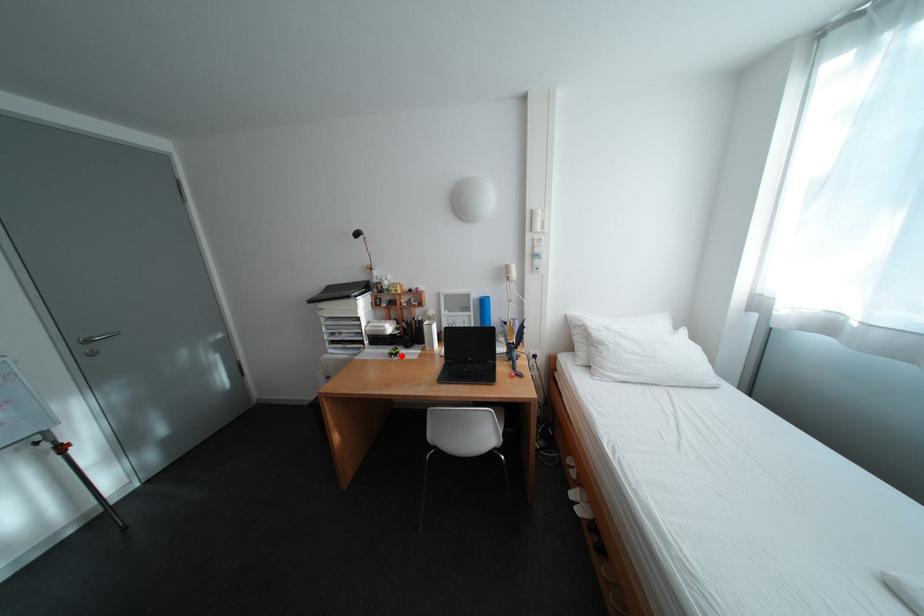
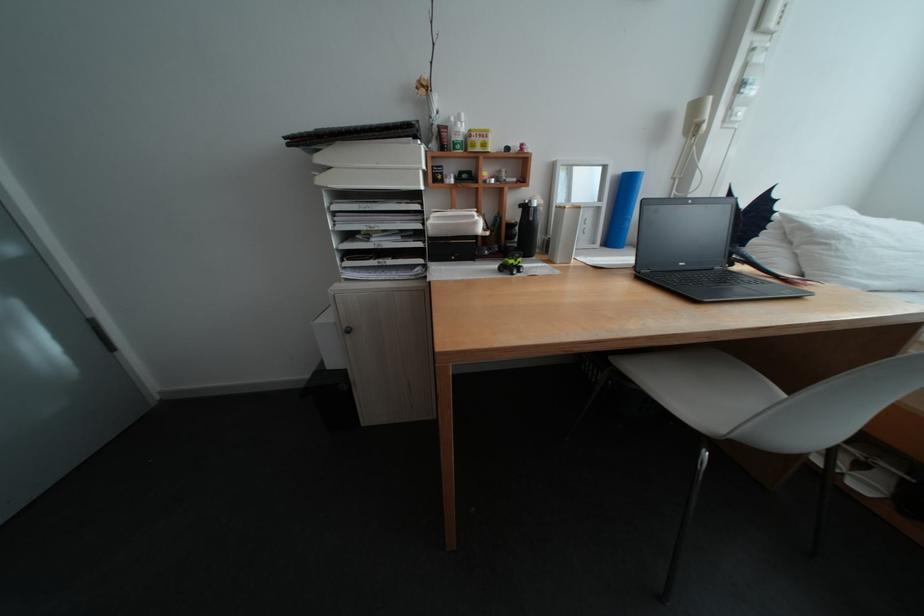
Where in the second image is the point corresponding to the highlighted location from the first image?

(511, 272)